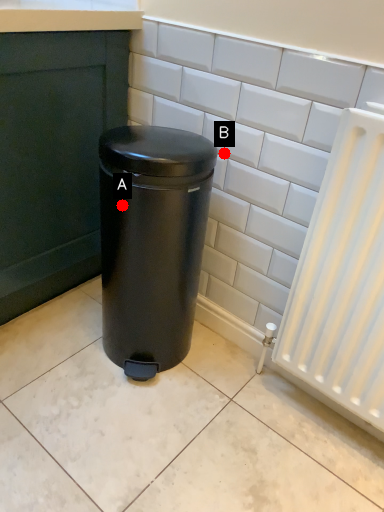
Question: Two points are circled on the image, labeled by A and B beside each circle. Which point is farther to the camera?

Choices:
 (A) A is further
 (B) B is further

Answer: (B)